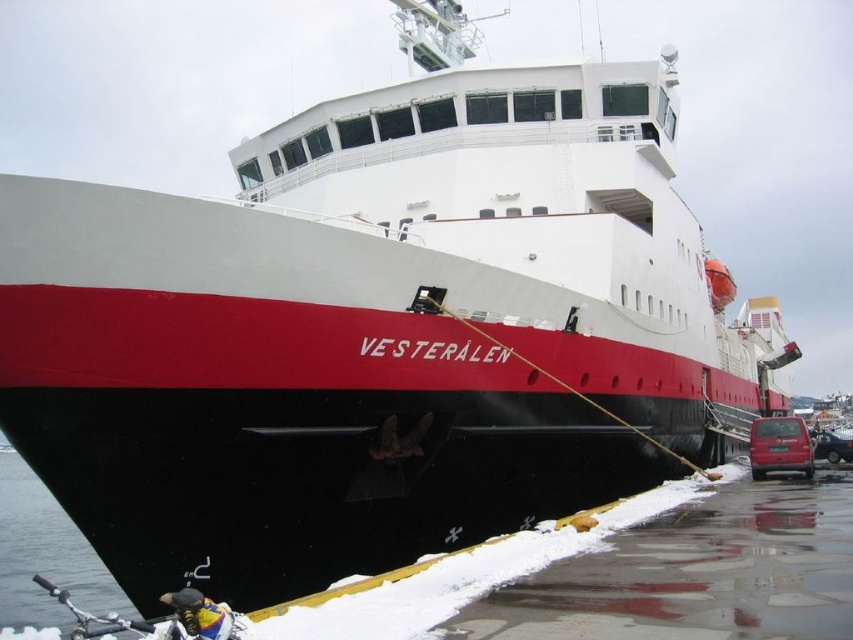
Question: Which point appears closest to the camera in this image?

Choices:
 (A) (793, 429)
 (B) (843, 449)

Answer: (A)

Question: From the image, what is the correct spatial relationship of matte red van at lower right in relation to metallic silver car at lower right?

Choices:
 (A) below
 (B) above

Answer: (B)

Question: Can you confirm if matte red van at lower right is positioned to the left of metallic silver car at lower right?

Choices:
 (A) yes
 (B) no

Answer: (A)

Question: Does matte red van at lower right appear on the left side of metallic silver car at lower right?

Choices:
 (A) yes
 (B) no

Answer: (A)